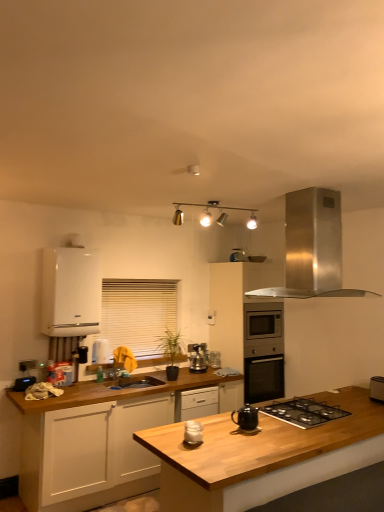
What do you see at coordinates (303, 412) in the screenshot? This screenshot has height=512, width=384. I see `black matte gas stove at center` at bounding box center [303, 412].

The height and width of the screenshot is (512, 384). I want to click on white matte cabinet at lower left, arranged as the 2th cabinetry when viewed from the left, so click(94, 442).

Measure the distance between point (194,432) and camera.

A distance of 2.55 meters exists between point (194,432) and camera.

Describe the element at coordinates (193, 433) in the screenshot. I see `white matte jar at center, acting as the 3th kitchen appliance starting from the back` at that location.

I want to click on stainless steel oven at center, positioned as the 3th cabinetry in left-to-right order, so click(x=248, y=327).

At what (x,y) coordinates should I click in order to perform the action: click on black matte teapot at center, acting as the second kitchen appliance starting from the back. Please return your answer as a coordinate pair (x, y). The image size is (384, 512). Looking at the image, I should click on (246, 418).

At what (x,y) coordinates should I click in order to perform the action: click on black matte gas stove at center. Please return your answer as a coordinate pair (x, y). Looking at the image, I should click on (303, 412).

Between black matte teapot at center, acting as the second kitchen appliance starting from the back, and white matte jar at center, which is the first kitchen appliance in front-to-back order, which one is positioned behind?

black matte teapot at center, acting as the second kitchen appliance starting from the back, is further away from the camera.

Measure the distance between black matte teapot at center, the 2th kitchen appliance viewed from the front, and white matte jar at center, acting as the 3th kitchen appliance starting from the back.

The distance of black matte teapot at center, the 2th kitchen appliance viewed from the front, from white matte jar at center, acting as the 3th kitchen appliance starting from the back, is 33.94 centimeters.

The image size is (384, 512). What are the coordinates of `the 2nd kitchen appliance to the left of the black matte teapot at center, acting as the second kitchen appliance starting from the back, starting your count from the anchor` in the screenshot? It's located at (193, 433).

From the image's perspective, is black matte teapot at center, the 2th kitchen appliance viewed from the front, above white matte jar at center, which is the first kitchen appliance in front-to-back order?

Yes.

Consider the image. How many degrees apart are the facing directions of black matte teapot at center, acting as the second kitchen appliance starting from the back, and stainless steel oven at center, acting as the 1th cabinetry starting from the right?

The angle between the facing direction of black matte teapot at center, acting as the second kitchen appliance starting from the back, and the facing direction of stainless steel oven at center, acting as the 1th cabinetry starting from the right, is 180 degrees.

Is black matte teapot at center, acting as the second kitchen appliance starting from the back, thinner than stainless steel oven at center, positioned as the 3th cabinetry in left-to-right order?

Indeed, black matte teapot at center, acting as the second kitchen appliance starting from the back, has a lesser width compared to stainless steel oven at center, positioned as the 3th cabinetry in left-to-right order.

Considering the relative sizes of black matte teapot at center, acting as the second kitchen appliance starting from the back, and stainless steel oven at center, positioned as the 3th cabinetry in left-to-right order, in the image provided, is black matte teapot at center, acting as the second kitchen appliance starting from the back, smaller than stainless steel oven at center, positioned as the 3th cabinetry in left-to-right order,?

Yes.

Is satin silver toaster at lower right looking in the opposite direction of black matte teapot at center, acting as the second kitchen appliance starting from the back?

satin silver toaster at lower right does not have its back to black matte teapot at center, acting as the second kitchen appliance starting from the back.

Can you confirm if satin silver toaster at lower right is shorter than black matte teapot at center, the 2th kitchen appliance viewed from the front?

In fact, satin silver toaster at lower right may be taller than black matte teapot at center, the 2th kitchen appliance viewed from the front.

Based on the photo, does satin silver toaster at lower right have a smaller size compared to black matte teapot at center, the 2th kitchen appliance viewed from the front?

No.

From the picture: Which is correct: metallic track lighting at upper center is inside white blinds at center, or outside of it?

The correct answer is: outside.

Is metallic track lighting at upper center at the right side of white blinds at center?

Yes, metallic track lighting at upper center is to the right of white blinds at center.

The image size is (384, 512). In order to click on window screen that appears behind the metallic track lighting at upper center in this screenshot , I will do point(133,318).

Is point (215, 383) closer to viewer compared to point (256, 225)?

Yes, point (215, 383) is in front of point (256, 225).

Can you tell me how much white matte cabinet at lower left, positioned as the second cabinetry in right-to-left order, and metallic track lighting at upper center differ in facing direction?

The angular difference between white matte cabinet at lower left, positioned as the second cabinetry in right-to-left order, and metallic track lighting at upper center is 3.42 degrees.

Is the depth of white matte cabinet at lower left, arranged as the 2th cabinetry when viewed from the left, less than that of metallic track lighting at upper center?

Yes, white matte cabinet at lower left, arranged as the 2th cabinetry when viewed from the left, is in front of metallic track lighting at upper center.

Looking at this image, is white matte cabinet at lower left, arranged as the 2th cabinetry when viewed from the left, next to metallic track lighting at upper center?

No, white matte cabinet at lower left, arranged as the 2th cabinetry when viewed from the left, is not in contact with metallic track lighting at upper center.

The image size is (384, 512). What are the coordinates of `kitchen appliance located on the right of satin silver kettle at center, marked as the 1th kitchen appliance in a back-to-front arrangement` in the screenshot? It's located at (246, 418).

Looking at the image, does black matte teapot at center, acting as the second kitchen appliance starting from the back, seem bigger or smaller compared to satin silver kettle at center, positioned as the 3th kitchen appliance in front-to-back order?

black matte teapot at center, acting as the second kitchen appliance starting from the back, is smaller than satin silver kettle at center, positioned as the 3th kitchen appliance in front-to-back order.

Which of these two, black matte teapot at center, the 2th kitchen appliance viewed from the front, or satin silver kettle at center, positioned as the 3th kitchen appliance in front-to-back order, stands taller?

With more height is satin silver kettle at center, positioned as the 3th kitchen appliance in front-to-back order.

From a real-world perspective, which is physically above, black matte teapot at center, acting as the second kitchen appliance starting from the back, or satin silver kettle at center, marked as the 1th kitchen appliance in a back-to-front arrangement?

satin silver kettle at center, marked as the 1th kitchen appliance in a back-to-front arrangement, from a real-world perspective.

From the picture: How different are the orientations of black matte teapot at center, acting as the second kitchen appliance starting from the back, and metallic track lighting at upper center in degrees?

177 degrees separate the facing orientations of black matte teapot at center, acting as the second kitchen appliance starting from the back, and metallic track lighting at upper center.

From the image's perspective, is black matte teapot at center, acting as the second kitchen appliance starting from the back, positioned above or below metallic track lighting at upper center?

black matte teapot at center, acting as the second kitchen appliance starting from the back, is below metallic track lighting at upper center.

From the picture: Is black matte teapot at center, the 2th kitchen appliance viewed from the front, bigger than metallic track lighting at upper center?

No, black matte teapot at center, the 2th kitchen appliance viewed from the front, is not bigger than metallic track lighting at upper center.

Where is `kitchen appliance that is the 1st one when counting backward from the white matte jar at center, acting as the 3th kitchen appliance starting from the back`? kitchen appliance that is the 1st one when counting backward from the white matte jar at center, acting as the 3th kitchen appliance starting from the back is located at coordinates (246, 418).

Where is `cabinetry that is the 1st one above the black matte teapot at center, the 2th kitchen appliance viewed from the front (from a real-world perspective)`? The height and width of the screenshot is (512, 384). cabinetry that is the 1st one above the black matte teapot at center, the 2th kitchen appliance viewed from the front (from a real-world perspective) is located at coordinates (248, 327).

Which object lies nearer to the anchor point wooden at center, metallic track lighting at upper center or black matte teapot at center, the 2th kitchen appliance viewed from the front?

black matte teapot at center, the 2th kitchen appliance viewed from the front, lies closer to wooden at center than the other object.

Estimate the real-world distances between objects in this image. Which object is further from satin silver toaster at lower right, satin silver kettle at center, positioned as the 3th kitchen appliance in front-to-back order, or wooden at center?

satin silver kettle at center, positioned as the 3th kitchen appliance in front-to-back order, lies further to satin silver toaster at lower right than the other object.

Considering their positions, is satin silver toaster at lower right positioned further to white matte jar at center, acting as the 3th kitchen appliance starting from the back, than metallic track lighting at upper center?

metallic track lighting at upper center lies further to white matte jar at center, acting as the 3th kitchen appliance starting from the back, than the other object.

Which object lies nearer to the anchor point white matte cabinet at left, the first cabinetry from the left, metallic track lighting at upper center or wooden at center?

metallic track lighting at upper center lies closer to white matte cabinet at left, the first cabinetry from the left, than the other object.

Looking at the image, which one is located further to satin silver kettle at center, marked as the 1th kitchen appliance in a back-to-front arrangement, white matte cabinet at lower left, positioned as the second cabinetry in right-to-left order, or white matte cabinet at left, the first cabinetry from the left?

white matte cabinet at left, the first cabinetry from the left, lies further to satin silver kettle at center, marked as the 1th kitchen appliance in a back-to-front arrangement, than the other object.

Looking at the image, which one is located closer to black matte teapot at center, acting as the second kitchen appliance starting from the back, stainless steel range hood at upper right or satin silver kettle at center, positioned as the 3th kitchen appliance in front-to-back order?

stainless steel range hood at upper right.

Estimate the real-world distances between objects in this image. Which object is closer to black matte gas stove at center, white blinds at center or black matte teapot at center, the 2th kitchen appliance viewed from the front?

The object closer to black matte gas stove at center is black matte teapot at center, the 2th kitchen appliance viewed from the front.

From the image, which object appears to be nearer to black matte gas stove at center, white matte cabinet at left, the first cabinetry from the left, or white matte cabinet at lower left, arranged as the 2th cabinetry when viewed from the left?

white matte cabinet at lower left, arranged as the 2th cabinetry when viewed from the left, is closer to black matte gas stove at center.

At what (x,y) coordinates should I click in order to perform the action: click on window screen between black matte teapot at center, acting as the second kitchen appliance starting from the back, and satin silver kettle at center, marked as the 1th kitchen appliance in a back-to-front arrangement, from front to back. Please return your answer as a coordinate pair (x, y). The width and height of the screenshot is (384, 512). Looking at the image, I should click on (133, 318).

Find the location of a particular element. The height and width of the screenshot is (512, 384). window screen between black matte gas stove at center and stainless steel oven at center, positioned as the 3th cabinetry in left-to-right order, from front to back is located at coordinates pyautogui.click(x=133, y=318).

Identify the location of home appliance between white blinds at center and satin silver toaster at lower right in the horizontal direction. The image size is (384, 512). pyautogui.click(x=312, y=248).

Locate an element on the screen. This screenshot has width=384, height=512. home appliance positioned between wooden at center and stainless steel oven at center, positioned as the 3th cabinetry in left-to-right order, from near to far is located at coordinates (312, 248).